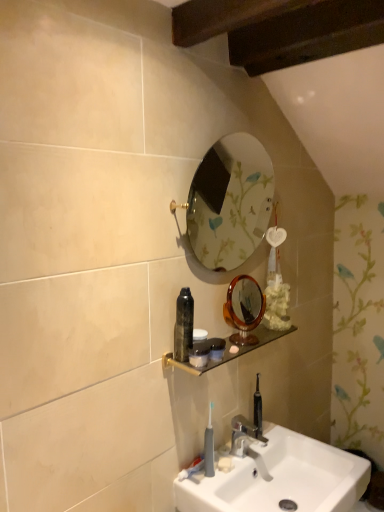
Question: Is amber glass mirror at center, which is counted as the second mirror, starting from the top, turned away from wooden shelf at center?

Choices:
 (A) no
 (B) yes

Answer: (A)

Question: From a real-world perspective, is amber glass mirror at center, which is the 1th mirror from bottom to top, located beneath wooden shelf at center?

Choices:
 (A) no
 (B) yes

Answer: (A)

Question: Considering the relative sizes of amber glass mirror at center, which is counted as the second mirror, starting from the top, and wooden shelf at center in the image provided, is amber glass mirror at center, which is counted as the second mirror, starting from the top, wider than wooden shelf at center?

Choices:
 (A) yes
 (B) no

Answer: (B)

Question: Is amber glass mirror at center, which is the 1th mirror from bottom to top, far away from wooden shelf at center?

Choices:
 (A) no
 (B) yes

Answer: (A)

Question: Is amber glass mirror at center, which is the 1th mirror from bottom to top, next to wooden shelf at center and touching it?

Choices:
 (A) no
 (B) yes

Answer: (B)

Question: Considering the relative positions of amber glass mirror at center, which is the 1th mirror from bottom to top, and wooden shelf at center in the image provided, is amber glass mirror at center, which is the 1th mirror from bottom to top, to the right of wooden shelf at center from the viewer's perspective?

Choices:
 (A) no
 (B) yes

Answer: (B)

Question: From a real-world perspective, is translucent plastic jar at shelf, the 2th mouthwash positioned from the top, on black glossy bottle at center, which is counted as the 1th mouthwash, starting from the top?

Choices:
 (A) no
 (B) yes

Answer: (A)

Question: Is translucent plastic jar at shelf, the 2th mouthwash positioned from the top, further to camera compared to black glossy bottle at center, which is counted as the 1th mouthwash, starting from the top?

Choices:
 (A) yes
 (B) no

Answer: (B)

Question: From the image's perspective, is translucent plastic jar at shelf, the 2th mouthwash positioned from the top, below black glossy bottle at center, which is counted as the 1th mouthwash, starting from the top?

Choices:
 (A) no
 (B) yes

Answer: (B)

Question: Is translucent plastic jar at shelf, the 1th mouthwash from the bottom, bigger than black glossy bottle at center, which is counted as the 1th mouthwash, starting from the top?

Choices:
 (A) yes
 (B) no

Answer: (B)

Question: Does translucent plastic jar at shelf, the 1th mouthwash from the bottom, have a lesser height compared to black glossy bottle at center, which is counted as the 1th mouthwash, starting from the top?

Choices:
 (A) no
 (B) yes

Answer: (B)

Question: Does translucent plastic jar at shelf, the 2th mouthwash positioned from the top, have a smaller size compared to black glossy bottle at center, the 2th mouthwash positioned from the bottom?

Choices:
 (A) yes
 (B) no

Answer: (A)

Question: From a real-world perspective, is gold-framed mirror at upper center, marked as the first mirror in a top-to-bottom arrangement, below black glossy bottle at center, the 2th mouthwash positioned from the bottom?

Choices:
 (A) yes
 (B) no

Answer: (B)